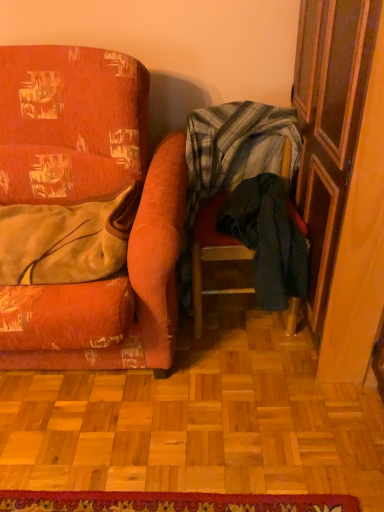
Find the location of a particular element. This screenshot has height=512, width=384. free location to the right of red woven mat at lower center is located at coordinates (288, 450).